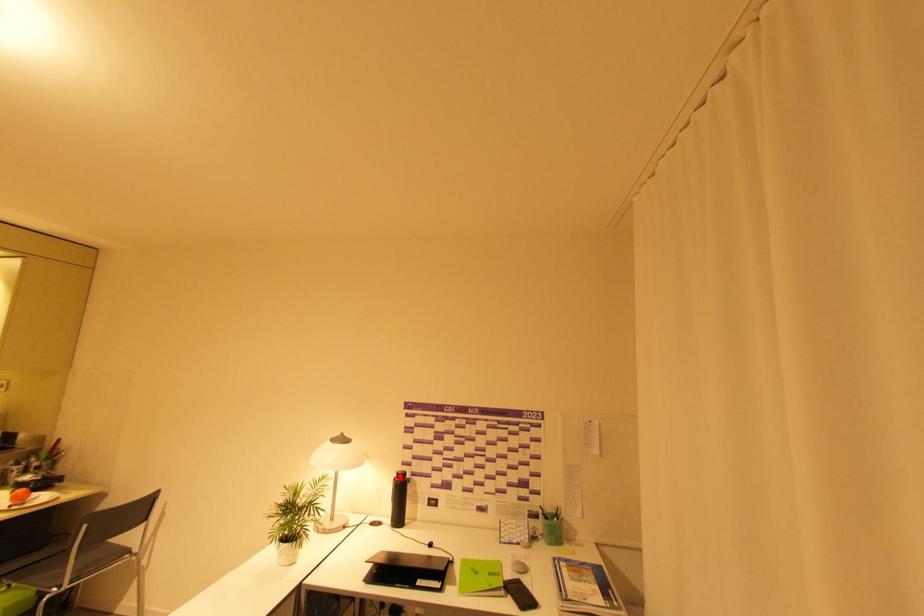
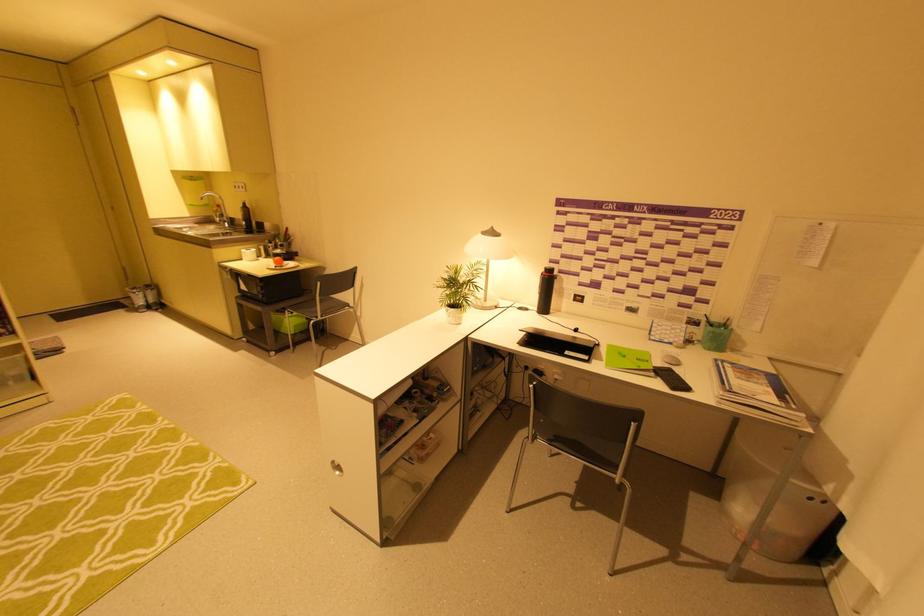
Find the pixel in the second image that matches the highlighted location in the first image.

(546, 270)